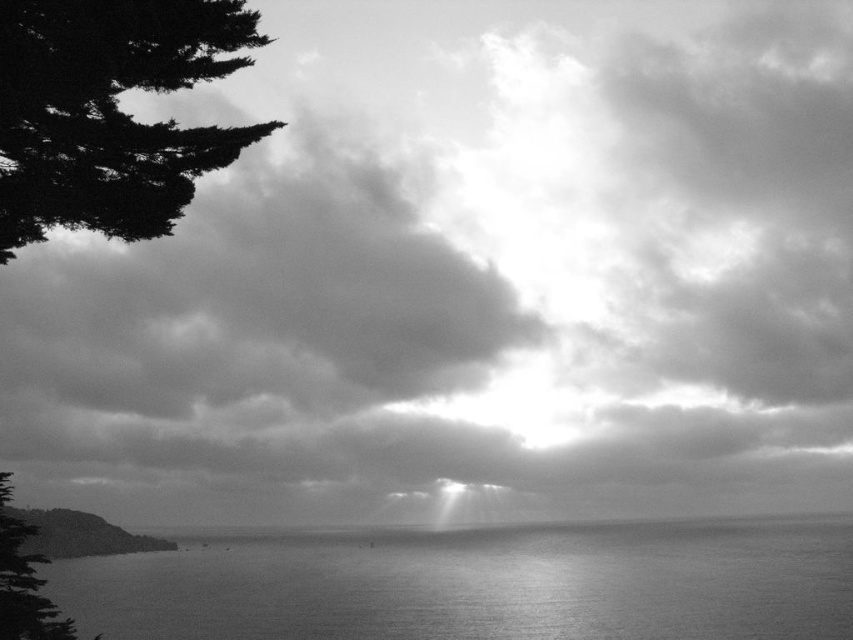
Question: Based on their relative distances, which object is nearer to the smooth water at center?

Choices:
 (A) dark green textured tree at upper left
 (B) silvery textured tree at left

Answer: (B)

Question: From the image, what is the correct spatial relationship of smooth water at center in relation to silvery textured tree at left?

Choices:
 (A) below
 (B) above

Answer: (A)

Question: Which point is farther to the camera?

Choices:
 (A) smooth water at center
 (B) silvery textured tree at left

Answer: (A)

Question: Which is nearer to the silvery textured tree at left?

Choices:
 (A) dark green textured tree at upper left
 (B) smooth water at center

Answer: (A)

Question: Is smooth water at center positioned in front of silvery textured tree at left?

Choices:
 (A) no
 (B) yes

Answer: (A)

Question: Is smooth water at center bigger than dark green textured tree at upper left?

Choices:
 (A) yes
 (B) no

Answer: (A)